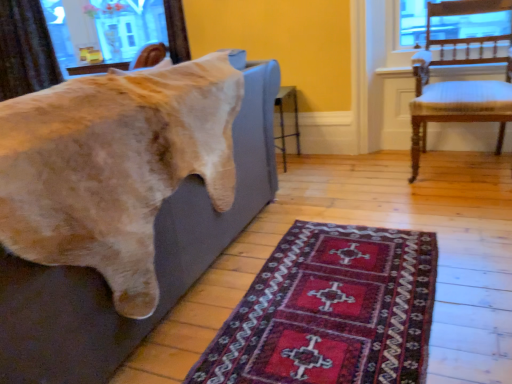
Identify the location of vacant area that lies between wooden chair with white cushioning at right and dark red woven rug at lower center. Image resolution: width=512 pixels, height=384 pixels. (424, 215).